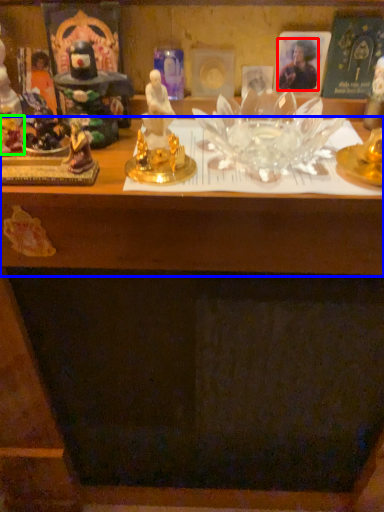
Question: Which object is the farthest from person (highlighted by a red box)? Choose among these: table (highlighted by a blue box) or toy (highlighted by a green box).

Choices:
 (A) table
 (B) toy

Answer: (B)